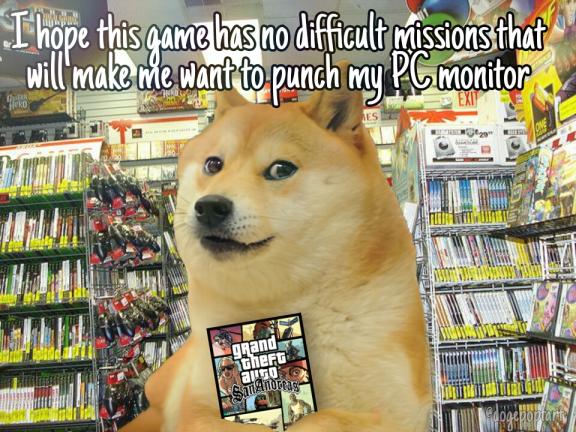
Locate an element on the screen. rack is located at coordinates (428, 224), (90, 269), (166, 274), (537, 228).